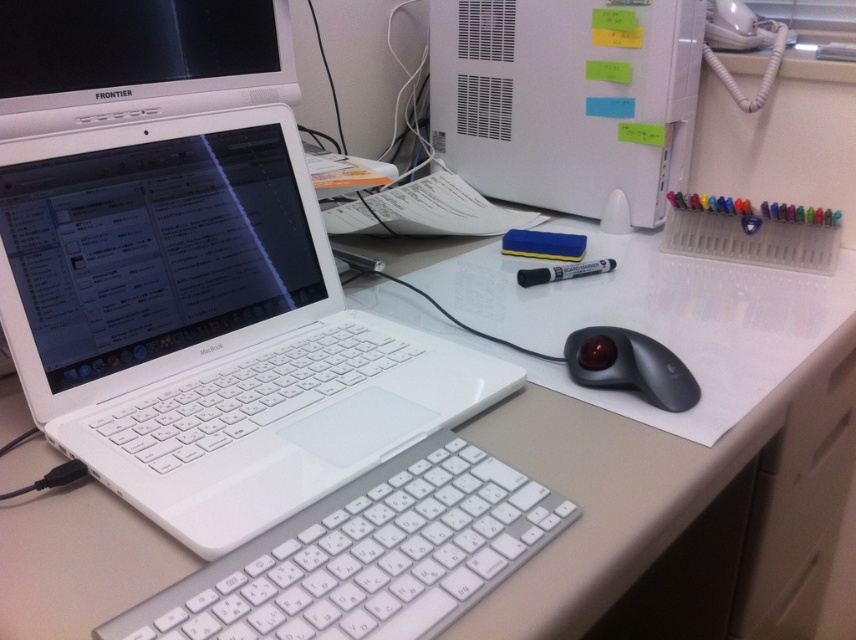
Question: Does white glossy laptop at left have a smaller size compared to white glossy table at center?

Choices:
 (A) yes
 (B) no

Answer: (A)

Question: Which point is closer to the camera?

Choices:
 (A) (508, 68)
 (B) (287, 589)
 (C) (673, 400)

Answer: (B)

Question: Can you confirm if white matte desktop computer at upper center is positioned above black rubberized trackball at lower right?

Choices:
 (A) yes
 (B) no

Answer: (A)

Question: Which of these objects is positioned farthest from the black rubberized trackball at lower right?

Choices:
 (A) white glossy computer monitor at upper left
 (B) white glossy laptop at left
 (C) white plastic keyboard at center
 (D) white matte desktop computer at upper center

Answer: (A)

Question: Does white glossy laptop at left appear on the right side of white glossy table at center?

Choices:
 (A) no
 (B) yes

Answer: (A)

Question: Estimate the real-world distances between objects in this image. Which object is closer to the white glossy laptop at left?

Choices:
 (A) white plastic keyboard at center
 (B) white matte desktop computer at upper center
 (C) white glossy computer monitor at upper left
 (D) white glossy table at center

Answer: (A)